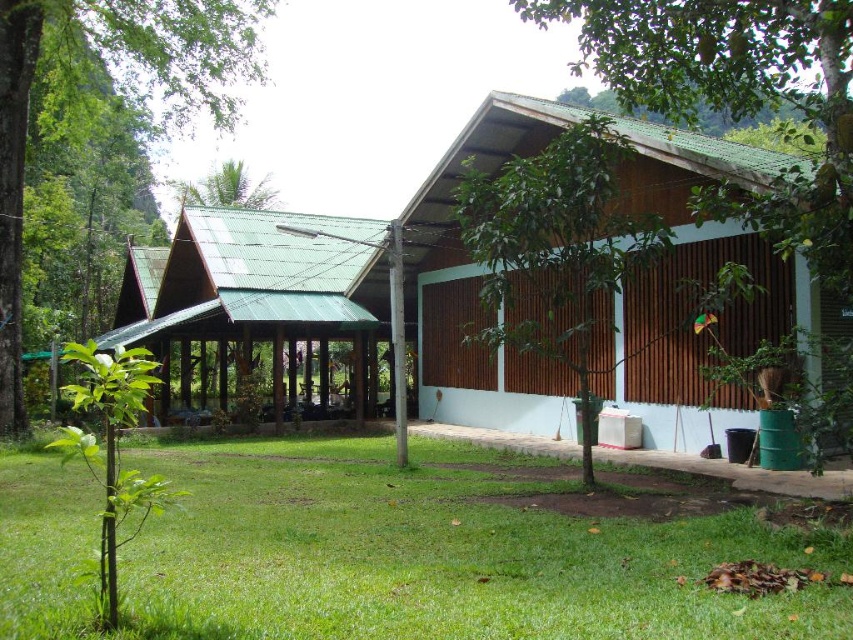
Is green corrugated metal hut at center closer to the viewer compared to green leafy tree at left?

No, green corrugated metal hut at center is further to the viewer.

Can you confirm if green corrugated metal hut at center is bigger than green leafy tree at left?

No, green corrugated metal hut at center is not bigger than green leafy tree at left.

The height and width of the screenshot is (640, 853). Identify the location of green corrugated metal hut at center. (254, 298).

Is point (251, 440) positioned in front of point (247, 172)?

Yes, it is.

Based on the photo, is green grass at lower center smaller than green leafy palm tree at upper left?

Yes, green grass at lower center is smaller than green leafy palm tree at upper left.

Where is `green grass at lower center`? This screenshot has width=853, height=640. green grass at lower center is located at coordinates click(442, 552).

Is green grass at lower center above green corrugated metal hut at center?

No.

Who is more forward, (735, 624) or (318, 216)?

Point (735, 624) is in front.

Locate an element on the screen. green grass at lower center is located at coordinates (442, 552).